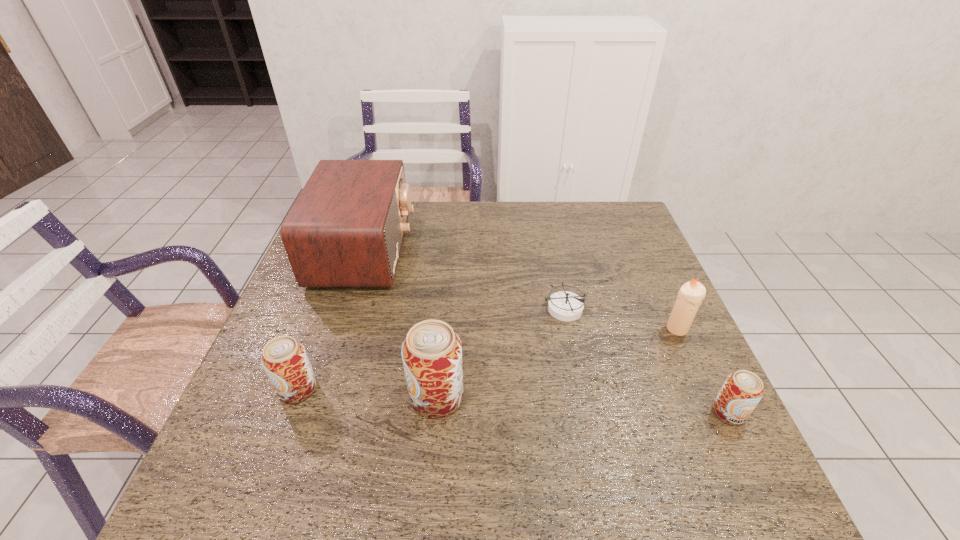
Where is `free point located 0.310m on the back of the leftmost beer can`? The width and height of the screenshot is (960, 540). free point located 0.310m on the back of the leftmost beer can is located at coordinates (337, 282).

Find the location of `free space located on the back of the third object from left to right`. free space located on the back of the third object from left to right is located at coordinates (446, 286).

In order to click on vacant region located 0.320m on the left of the rightmost beer can in this screenshot , I will do `click(561, 413)`.

Identify the location of vacant region located 0.210m on the front panel of the radio receiver. Image resolution: width=960 pixels, height=540 pixels. (478, 251).

I want to click on blank area located on the back of the third object from right to left, so point(546,219).

Image resolution: width=960 pixels, height=540 pixels. Identify the location of free space located on the left of the candle. click(x=570, y=329).

The height and width of the screenshot is (540, 960). Find the location of `object positioned at the far edge`. object positioned at the far edge is located at coordinates (346, 228).

I want to click on beer can positioned at the left edge, so click(284, 359).

Find the location of `radio receiver that is at the left edge`. radio receiver that is at the left edge is located at coordinates (346, 228).

At what (x,y) coordinates should I click in order to perform the action: click on beer can located in the right edge section of the desktop. Please return your answer as a coordinate pair (x, y). This screenshot has width=960, height=540. Looking at the image, I should click on (741, 392).